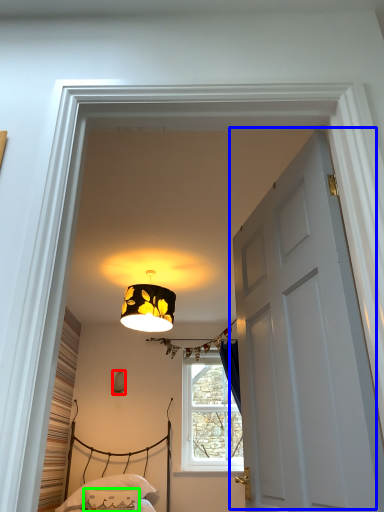
Question: Which is farther away from lamp (highlighted by a red box)? door (highlighted by a blue box) or pillow (highlighted by a green box)?

Choices:
 (A) door
 (B) pillow

Answer: (A)